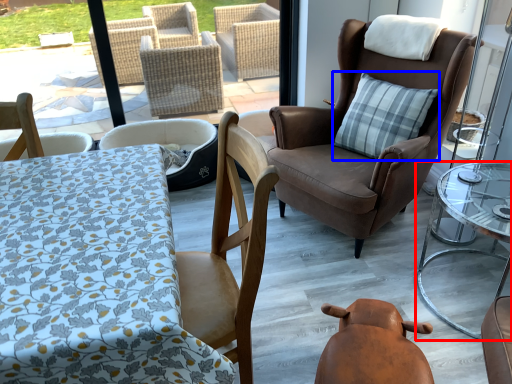
Question: Which of the following is the closest to the observer, table (highlighted by a red box) or pillow (highlighted by a blue box)?

Choices:
 (A) table
 (B) pillow

Answer: (A)